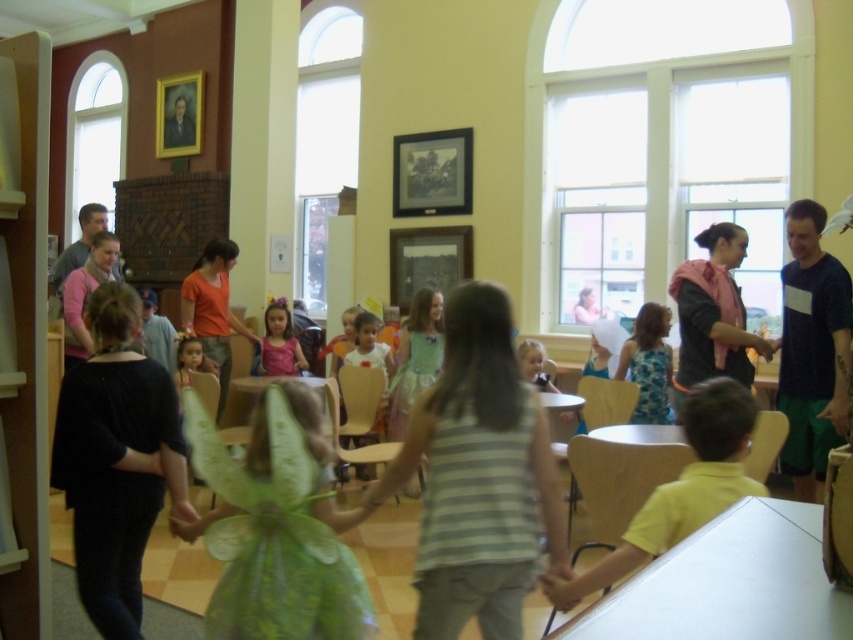
Does green fabric dress at center appear under dark blue t-shirt at right?

Indeed, green fabric dress at center is positioned under dark blue t-shirt at right.

Can you confirm if green fabric dress at center is positioned to the right of dark blue t-shirt at right?

In fact, green fabric dress at center is to the left of dark blue t-shirt at right.

The image size is (853, 640). Describe the element at coordinates (479, 477) in the screenshot. I see `green fabric dress at center` at that location.

Locate an element on the screen. The image size is (853, 640). green fabric dress at center is located at coordinates (479, 477).

Is pink fabric at center further to the viewer compared to pink satin dress at center?

No, it is in front of pink satin dress at center.

Who is more distant from viewer, (724, 232) or (283, 314)?

Point (283, 314)

At what (x,y) coordinates should I click in order to perform the action: click on pink fabric at center. Please return your answer as a coordinate pair (x, y). The height and width of the screenshot is (640, 853). Looking at the image, I should click on (712, 314).

Can you confirm if pink satin dress at center is positioned to the right of green tulle dress at center?

Correct, you'll find pink satin dress at center to the right of green tulle dress at center.

Is the position of pink satin dress at center less distant than that of green tulle dress at center?

No, pink satin dress at center is further to the viewer.

Describe the element at coordinates (280, 342) in the screenshot. Image resolution: width=853 pixels, height=640 pixels. I see `pink satin dress at center` at that location.

This screenshot has height=640, width=853. What are the coordinates of `pink satin dress at center` in the screenshot? It's located at (280, 342).